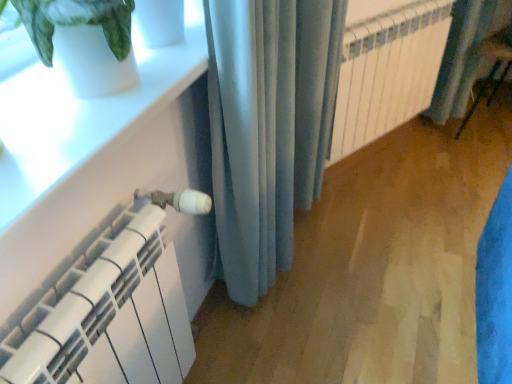
Question: Is white glossy window sill at upper left beside white metallic radiator at center?

Choices:
 (A) no
 (B) yes

Answer: (A)

Question: Does white glossy window sill at upper left have a smaller size compared to white metallic radiator at center?

Choices:
 (A) yes
 (B) no

Answer: (A)

Question: Can you confirm if white glossy window sill at upper left is thinner than white metallic radiator at center?

Choices:
 (A) no
 (B) yes

Answer: (A)

Question: From the image's perspective, would you say white glossy window sill at upper left is positioned over white metallic radiator at center?

Choices:
 (A) no
 (B) yes

Answer: (A)

Question: From the image's perspective, is white glossy window sill at upper left below white metallic radiator at center?

Choices:
 (A) no
 (B) yes

Answer: (B)

Question: Is blue fabric curtain at right, marked as the 2th curtain in a front-to-back arrangement, to the left or to the right of white matte heater at lower left in the image?

Choices:
 (A) right
 (B) left

Answer: (A)

Question: Is point (497, 1) closer or farther from the camera than point (116, 324)?

Choices:
 (A) farther
 (B) closer

Answer: (A)

Question: From a real-world perspective, is blue fabric curtain at right, marked as the 2th curtain in a front-to-back arrangement, above or below white matte heater at lower left?

Choices:
 (A) below
 (B) above

Answer: (A)

Question: In terms of height, does blue fabric curtain at right, which is the 1th curtain from back to front, look taller or shorter compared to white matte heater at lower left?

Choices:
 (A) short
 (B) tall

Answer: (A)

Question: From the image's perspective, is white metallic radiator at center above or below satin blue curtain at center, the first curtain from the front?

Choices:
 (A) above
 (B) below

Answer: (A)

Question: Is point (401, 79) positioned closer to the camera than point (224, 256)?

Choices:
 (A) farther
 (B) closer

Answer: (A)

Question: Would you say white metallic radiator at center is to the left or to the right of satin blue curtain at center, the second curtain in the right-to-left sequence, in the picture?

Choices:
 (A) left
 (B) right

Answer: (B)

Question: From a real-world perspective, is white metallic radiator at center above or below satin blue curtain at center, the second curtain in the back-to-front sequence?

Choices:
 (A) below
 (B) above

Answer: (A)

Question: Is point (177, 354) positioned closer to the camera than point (0, 129)?

Choices:
 (A) farther
 (B) closer

Answer: (A)

Question: Considering the relative positions of white matte heater at lower left and white glossy window sill at upper left in the image provided, is white matte heater at lower left to the left or to the right of white glossy window sill at upper left?

Choices:
 (A) right
 (B) left

Answer: (A)